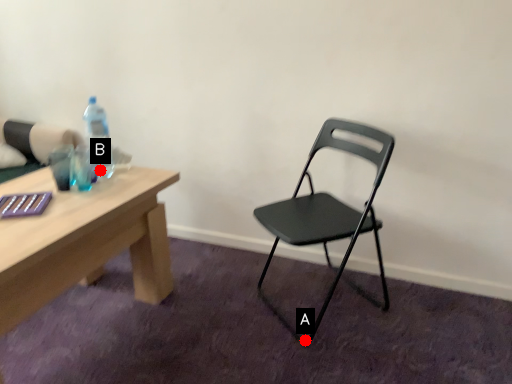
Question: Two points are circled on the image, labeled by A and B beside each circle. Among these points, which one is nearest to the camera?

Choices:
 (A) A is closer
 (B) B is closer

Answer: (A)